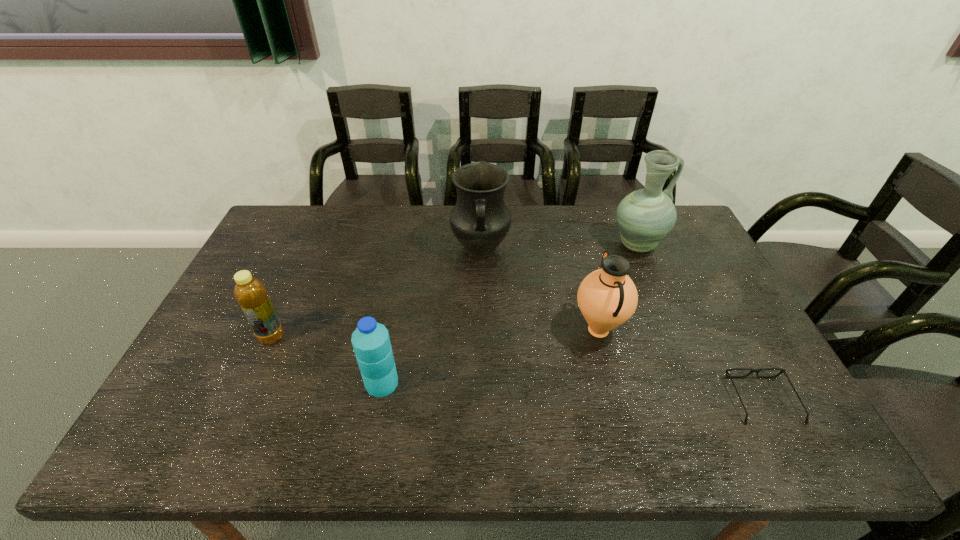
The width and height of the screenshot is (960, 540). Identify the location of the tallest pitcher. (646, 216).

Identify the location of the tallest object. The width and height of the screenshot is (960, 540). (646, 216).

What are the coordinates of `the fourth object from right to left` in the screenshot? It's located at (480, 220).

Identify the location of the second pitcher from left to right. (607, 297).

Find the location of a particular element. The height and width of the screenshot is (540, 960). the fourth object from left to right is located at coordinates (607, 297).

This screenshot has width=960, height=540. I want to click on bottle, so click(x=250, y=293).

Locate an element on the screen. This screenshot has width=960, height=540. the second object from left to right is located at coordinates (371, 342).

Where is `the shortest object`? the shortest object is located at coordinates (727, 371).

At what (x,y) coordinates should I click in order to perform the action: click on vacant space located 0.120m on the handle side of the tallest pitcher. Please return your answer as a coordinate pair (x, y). The image size is (960, 540). Looking at the image, I should click on (700, 245).

Identify the location of free space located on the handle side of the leftmost pitcher. This screenshot has width=960, height=540. (481, 360).